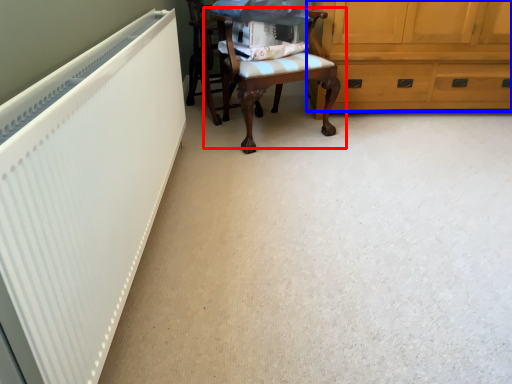
Question: Among these objects, which one is farthest to the camera, chair (highlighted by a red box) or cabinetry (highlighted by a blue box)?

Choices:
 (A) chair
 (B) cabinetry

Answer: (B)